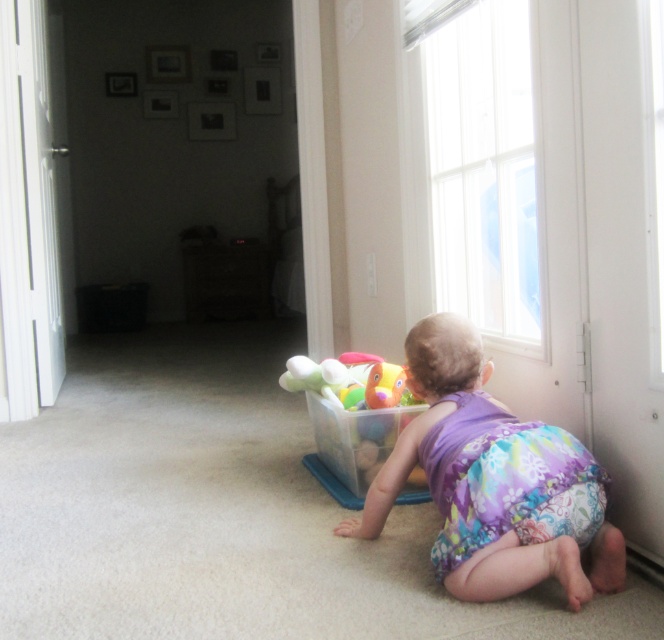
Question: Which of these objects is positioned closest to the translucent plastic container at center?

Choices:
 (A) floral fabric diaper at lower center
 (B) purple floral fabric toddler at lower right

Answer: (B)

Question: Is purple floral fabric toddler at lower right smaller than floral fabric diaper at lower center?

Choices:
 (A) no
 (B) yes

Answer: (A)

Question: Observing the image, what is the correct spatial positioning of floral fabric diaper at lower center in reference to translucent plastic container at center?

Choices:
 (A) left
 (B) right

Answer: (B)

Question: Which point is closer to the camera taking this photo?

Choices:
 (A) (359, 410)
 (B) (491, 525)

Answer: (B)

Question: Does purple floral fabric toddler at lower right have a larger size compared to floral fabric diaper at lower center?

Choices:
 (A) yes
 (B) no

Answer: (A)

Question: Which object is closer to the camera taking this photo?

Choices:
 (A) purple floral fabric toddler at lower right
 (B) floral fabric diaper at lower center
 (C) translucent plastic container at center

Answer: (A)